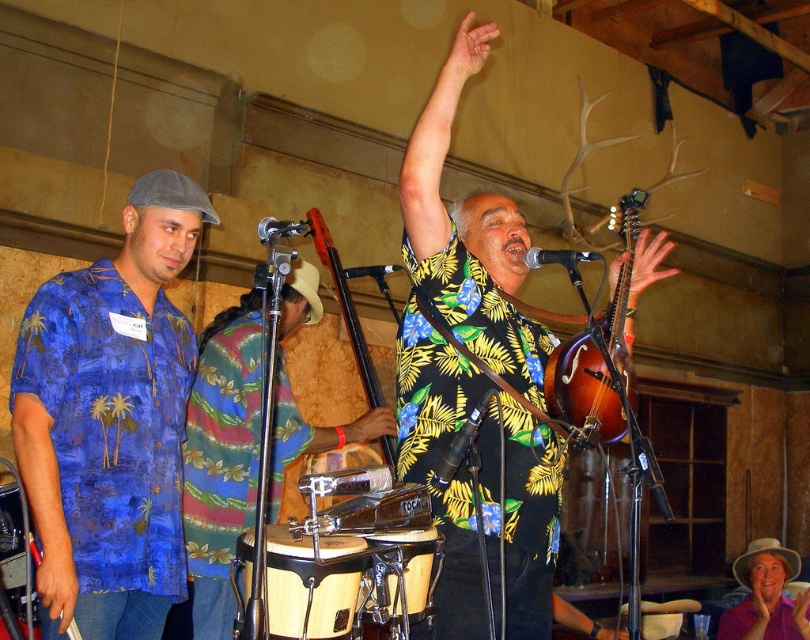
Looking at this image, you are a photographer positioned at the back of the venue. You need to capture a photo of both the multicolored fabric shirt at center and the wooden drum at center. Which object is wider so that it can be framed better in the shot?

The multicolored fabric shirt at center is wider than the wooden drum at center, so it can be framed better in the shot.